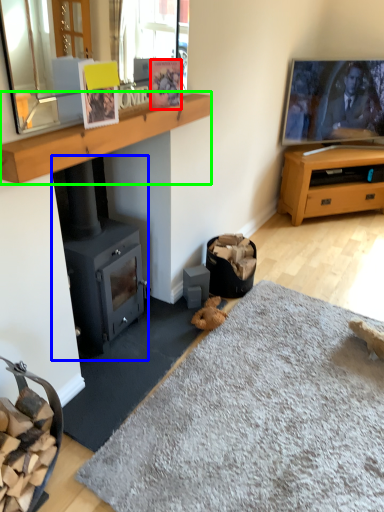
Question: Considering the real-world distances, which object is farthest from picture frame (highlighted by a red box)? wood burning stove (highlighted by a blue box) or mantle (highlighted by a green box)?

Choices:
 (A) wood burning stove
 (B) mantle

Answer: (A)